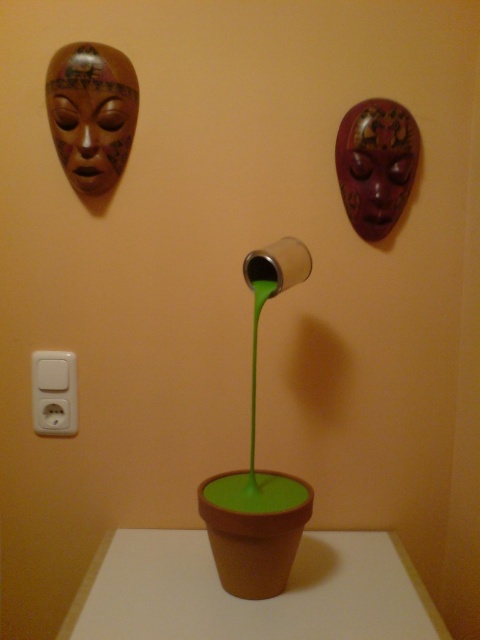
Between point (131, 99) and point (372, 195), which one is positioned behind?

Positioned behind is point (372, 195).

Can you confirm if matte brown mask at upper left is wider than matte brown mask at upper right?

Correct, the width of matte brown mask at upper left exceeds that of matte brown mask at upper right.

Find the location of a particular element. matte brown mask at upper left is located at coordinates (92, 129).

Between matte brown mask at upper right and white plastic electric outlet at lower left, which one appears on the left side from the viewer's perspective?

white plastic electric outlet at lower left

Does matte brown mask at upper right appear over white plastic electric outlet at lower left?

Correct, matte brown mask at upper right is located above white plastic electric outlet at lower left.

This screenshot has width=480, height=640. In order to click on matte brown mask at upper right in this screenshot , I will do `click(375, 186)`.

Does matte brown mask at upper left lie behind white plastic electric outlet at lower left?

No, matte brown mask at upper left is in front of white plastic electric outlet at lower left.

Who is lower down, matte brown mask at upper left or white plastic electric outlet at lower left?

white plastic electric outlet at lower left is lower down.

Locate an element on the screen. This screenshot has height=640, width=480. matte brown mask at upper left is located at coordinates (92, 129).

The height and width of the screenshot is (640, 480). What are the coordinates of `matte brown mask at upper left` in the screenshot? It's located at (92, 129).